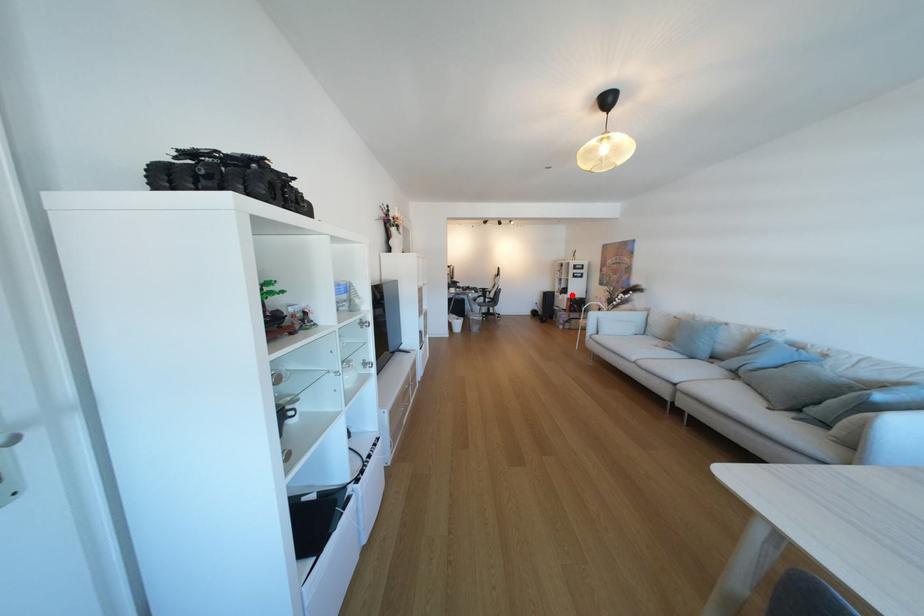
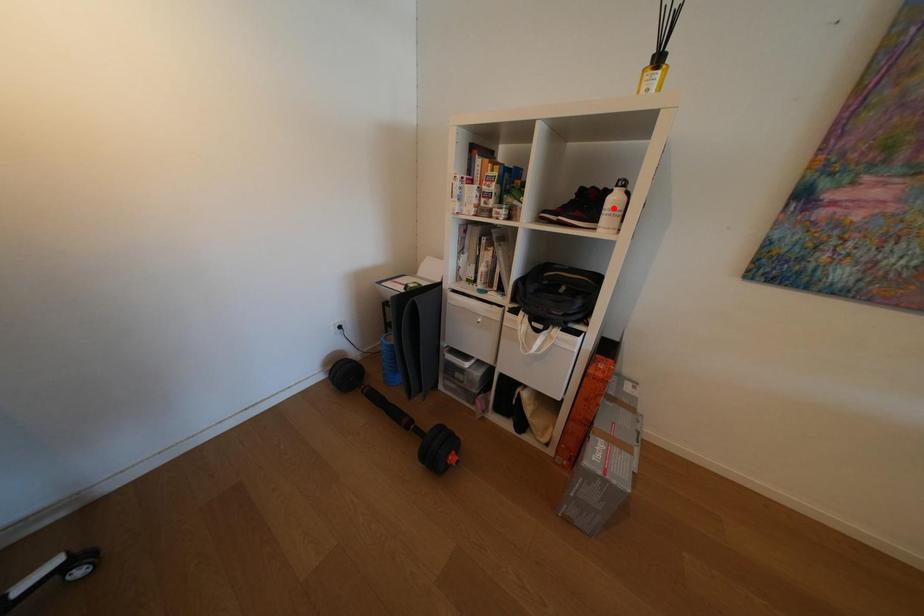
I am providing you with two images of the same scene from different viewpoints. A red point is marked on the first image and another point is marked on the second image. Do the highlighted points in image1 and image2 indicate the same real-world spot?

No